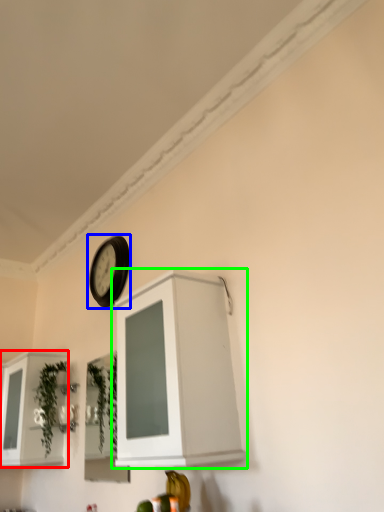
Question: Based on their relative distances, which object is nearer to cabinetry (highlighted by a red box)? Choose from clock (highlighted by a blue box) and cabinetry (highlighted by a green box).

Choices:
 (A) clock
 (B) cabinetry

Answer: (A)